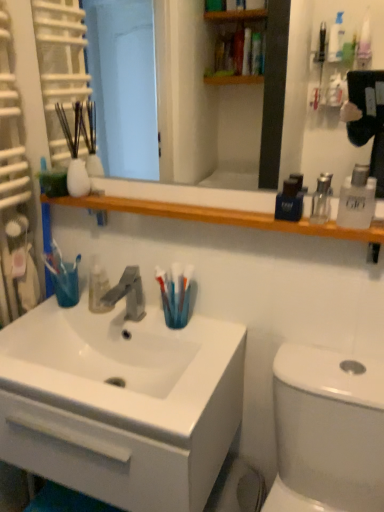
The height and width of the screenshot is (512, 384). Identify the location of space that is in front of blue plastic toothbrush at sink. (190, 362).